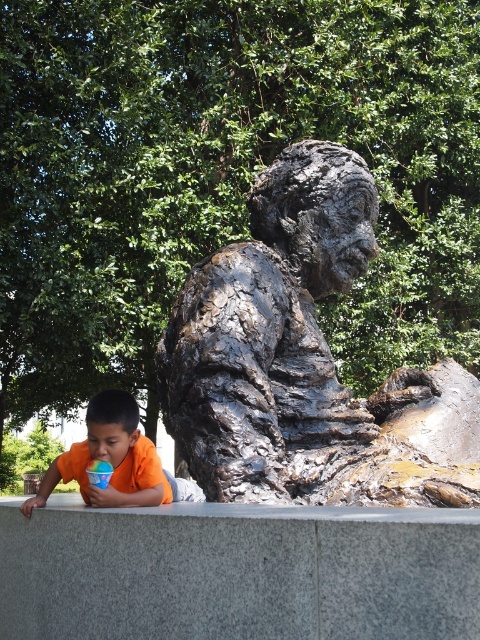
Question: Does shiny bronze statue at center appear over orange t-shirt at lower left?

Choices:
 (A) no
 (B) yes

Answer: (B)

Question: Considering the relative positions of shiny bronze statue at center and translucent plastic cup at lower left in the image provided, where is shiny bronze statue at center located with respect to translucent plastic cup at lower left?

Choices:
 (A) below
 (B) above

Answer: (B)

Question: Which point is farther from the camera taking this photo?

Choices:
 (A) (201, 406)
 (B) (451, 586)
 (C) (92, 465)

Answer: (A)

Question: Does shiny bronze statue at center appear under orange t-shirt at lower left?

Choices:
 (A) yes
 (B) no

Answer: (B)

Question: Among these points, which one is farthest from the camera?

Choices:
 (A) (160, 490)
 (B) (23, 576)
 (C) (186, 349)
 (D) (106, 480)

Answer: (C)

Question: Which object appears closest to the camera in this image?

Choices:
 (A) shiny bronze statue at center
 (B) orange t-shirt at lower left
 (C) gray granite ledge at center
 (D) translucent plastic cup at lower left

Answer: (C)